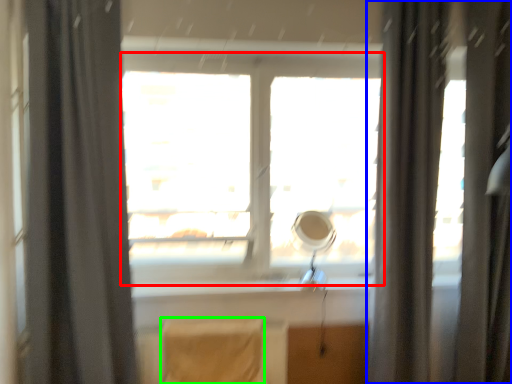
Question: Which is farther away from window (highlighted by a red box)? curtain (highlighted by a blue box) or chair (highlighted by a green box)?

Choices:
 (A) curtain
 (B) chair

Answer: (B)